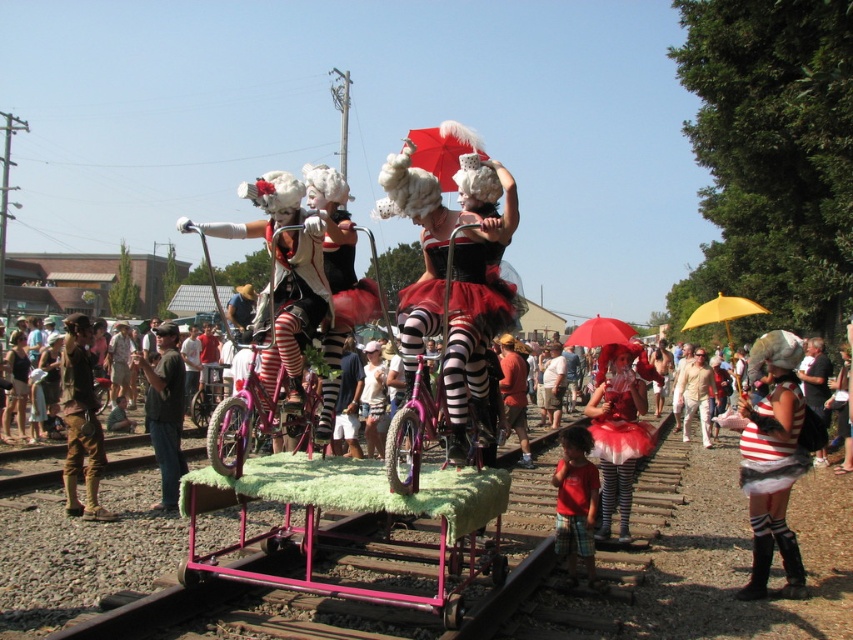
You are a costume designer observing the performers. Which costume item is shorter in length between the matte black tutu at center and the red cotton shirt at lower center?

The matte black tutu at center is shorter than the red cotton shirt at lower center.

Which object is wider, the matte black tutu at center or the red cotton shirt at lower center?

The matte black tutu at center is wider than the red cotton shirt at lower center.